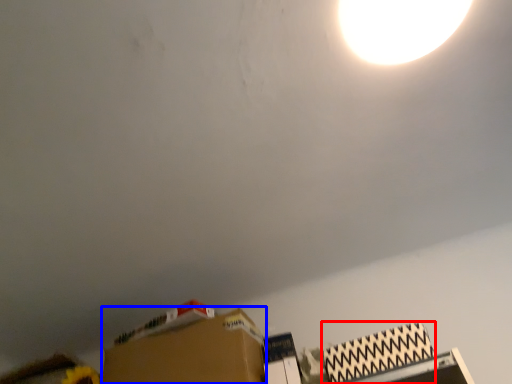
Question: Which of the following is the farthest to the observer, cardboard box (highlighted by a red box) or cardboard box (highlighted by a blue box)?

Choices:
 (A) cardboard box
 (B) cardboard box

Answer: (B)